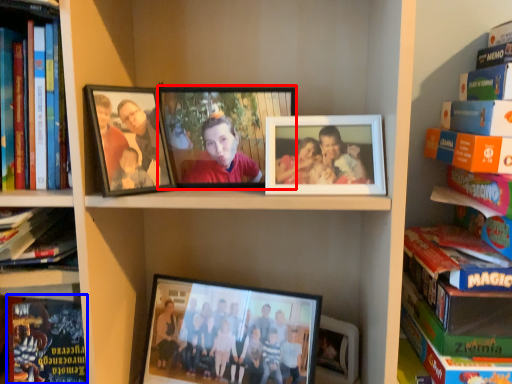
Question: Which object appears farthest to the camera in this image, picture frame (highlighted by a red box) or paperback book (highlighted by a blue box)?

Choices:
 (A) picture frame
 (B) paperback book

Answer: (B)